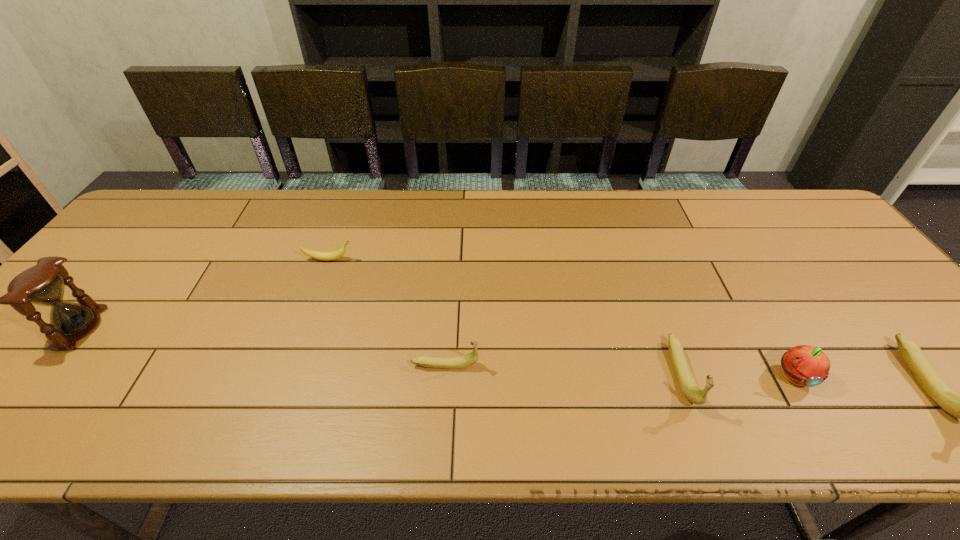
Locate an element on the screen. free space located 0.130m at the stem of the shortest object is located at coordinates (401, 259).

Identify the location of free space located 0.060m on the right of the second object from right to left. The image size is (960, 540). (842, 376).

In order to click on vacant region located on the back of the hourglass in this screenshot , I will do `click(130, 268)`.

Find the location of a particular element. The height and width of the screenshot is (540, 960). apple that is at the near edge is located at coordinates (803, 365).

Locate an element on the screen. object at the left edge is located at coordinates (43, 284).

In the image, there is a desktop. Where is `free space at the far edge`? This screenshot has height=540, width=960. free space at the far edge is located at coordinates (460, 220).

This screenshot has height=540, width=960. I want to click on free spot at the near edge of the desktop, so click(x=256, y=386).

You are a GUI agent. You are given a task and a screenshot of the screen. Output one action in this format:
    pyautogui.click(x=<x>, y=<y>)
    Task: Click on the vacant area at the left edge of the desktop
    This screenshot has height=540, width=960.
    Given the screenshot: What is the action you would take?
    (135, 269)

Where is `vacant area at the right edge of the desktop`? vacant area at the right edge of the desktop is located at coordinates (884, 344).

Where is `vacant point at the far left corner`? vacant point at the far left corner is located at coordinates (158, 220).